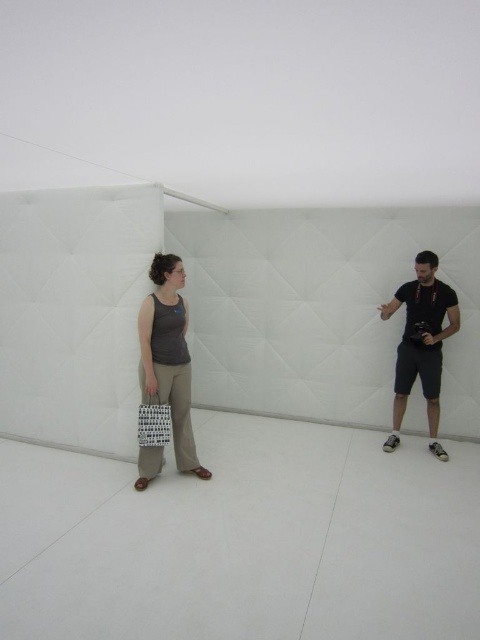
Does dark gray fabric camera at right appear on the right side of white matte shopping bag at center?

Yes, dark gray fabric camera at right is to the right of white matte shopping bag at center.

Is dark gray fabric camera at right thinner than white matte shopping bag at center?

Incorrect, dark gray fabric camera at right's width is not less than white matte shopping bag at center's.

Where is `dark gray fabric camera at right`? dark gray fabric camera at right is located at coordinates click(421, 344).

The height and width of the screenshot is (640, 480). Identify the location of dark gray fabric camera at right. (421, 344).

How far apart are matte gray tank top at center and white matte shopping bag at center?

matte gray tank top at center is 9.79 inches away from white matte shopping bag at center.

This screenshot has height=640, width=480. Describe the element at coordinates (168, 356) in the screenshot. I see `matte gray tank top at center` at that location.

You are a GUI agent. You are given a task and a screenshot of the screen. Output one action in this format:
    pyautogui.click(x=<x>, y=<y>)
    Task: Click on the matte gray tank top at center
    
    Given the screenshot: What is the action you would take?
    [168, 356]

Can you confirm if matte gray tank top at center is shorter than dark gray fabric camera at right?

Yes.

Is matte gray tank top at center to the right of dark gray fabric camera at right from the viewer's perspective?

No, matte gray tank top at center is not to the right of dark gray fabric camera at right.

Is point (149, 388) farther from viewer compared to point (429, 404)?

No, it is not.

Where is `matte gray tank top at center`? matte gray tank top at center is located at coordinates (168, 356).